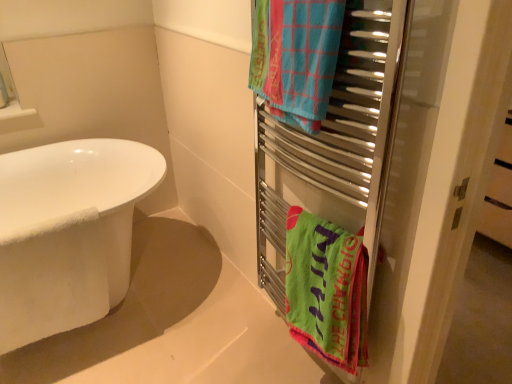
Where is `empty space that is to the right of white glossy bathtub at left`? Image resolution: width=512 pixels, height=384 pixels. empty space that is to the right of white glossy bathtub at left is located at coordinates (207, 305).